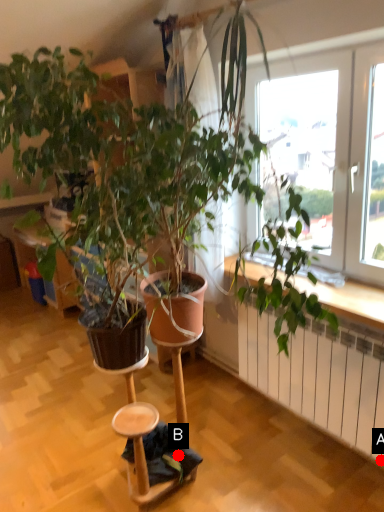
Question: Two points are circled on the image, labeled by A and B beside each circle. Which point is closer to the camera?

Choices:
 (A) A is closer
 (B) B is closer

Answer: (B)